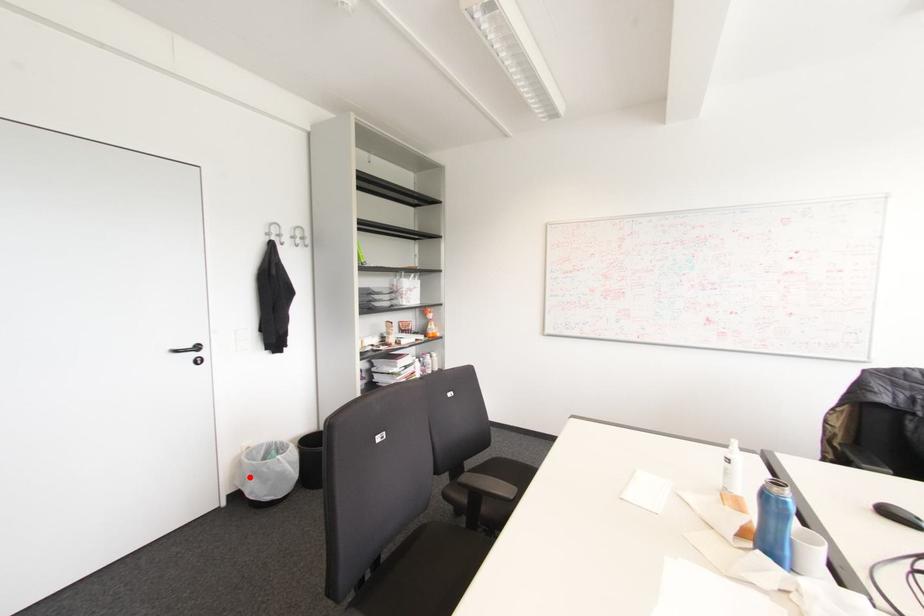
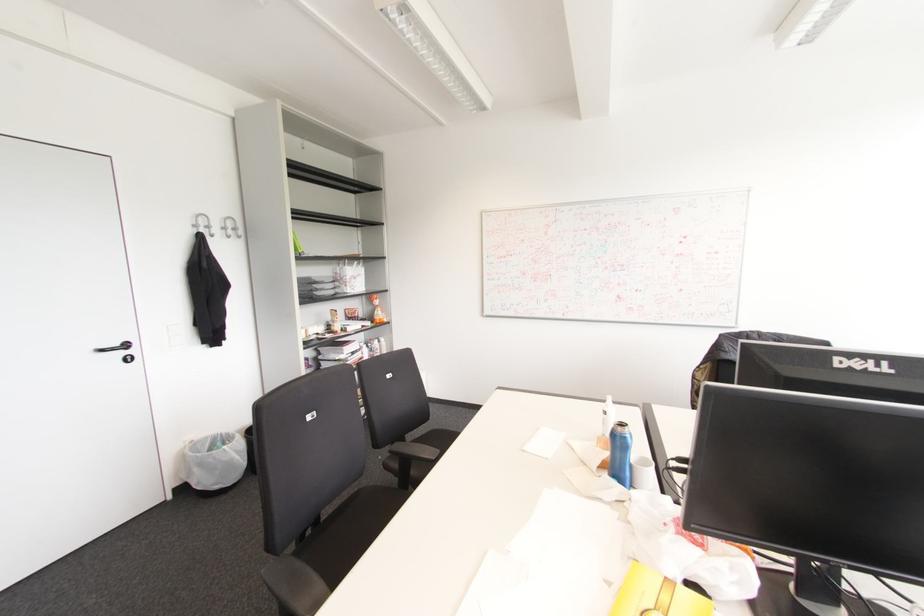
In the second image, find the point that corresponds to the highlighted location in the first image.

(195, 469)